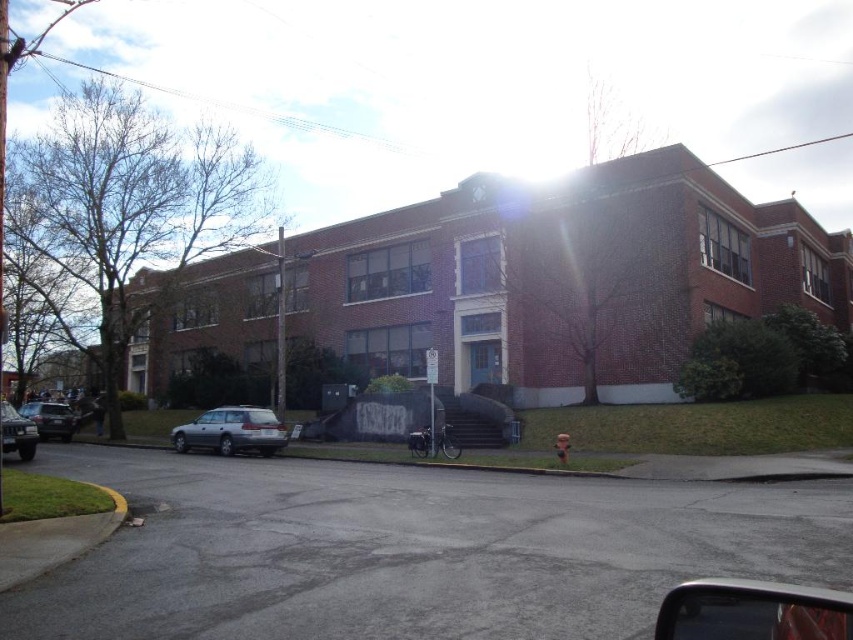
Does satin silver station wagon at lower left have a lesser width compared to metallic silver sedan at lower left?

Incorrect, satin silver station wagon at lower left's width is not less than metallic silver sedan at lower left's.

Which is in front, point (189, 428) or point (10, 420)?

Point (10, 420)

The height and width of the screenshot is (640, 853). In order to click on satin silver station wagon at lower left in this screenshot , I will do `click(231, 429)`.

Which is above, shiny silver sedan at left or metallic silver sedan at lower left?

metallic silver sedan at lower left is above.

Who is more forward, (59, 420) or (26, 436)?

Point (26, 436) is in front.

Does point (25, 416) come in front of point (33, 452)?

No, it is behind (33, 452).

This screenshot has width=853, height=640. I want to click on shiny silver sedan at left, so click(x=50, y=419).

Is satin silver station wagon at lower left closer to camera compared to shiny silver sedan at left?

Yes, satin silver station wagon at lower left is closer to the viewer.

Does satin silver station wagon at lower left appear over shiny silver sedan at left?

Yes, satin silver station wagon at lower left is above shiny silver sedan at left.

Is point (230, 449) positioned after point (47, 428)?

No, (230, 449) is in front of (47, 428).

You are a GUI agent. You are given a task and a screenshot of the screen. Output one action in this format:
    pyautogui.click(x=<x>, y=<y>)
    Task: Click on the satin silver station wagon at lower left
    The width and height of the screenshot is (853, 640).
    Given the screenshot: What is the action you would take?
    pyautogui.click(x=231, y=429)